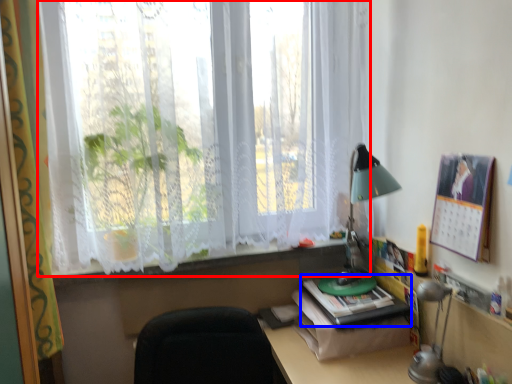
Question: Which object is closer to the camera taking this photo, window (highlighted by a red box) or paperback book (highlighted by a blue box)?

Choices:
 (A) window
 (B) paperback book

Answer: (A)